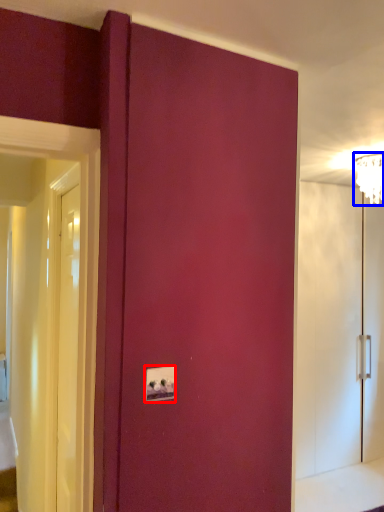
Question: Which point is closer to the camera, light switch (highlighted by a red box) or light fixture (highlighted by a blue box)?

Choices:
 (A) light switch
 (B) light fixture

Answer: (A)